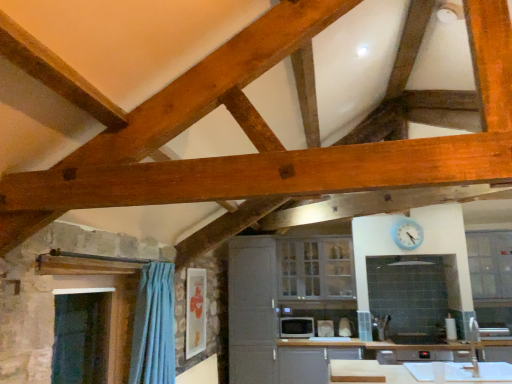
The height and width of the screenshot is (384, 512). Find the location of `free space in front of white glossy microwave at center, which ranks as the first appliance in right-to-left order`. free space in front of white glossy microwave at center, which ranks as the first appliance in right-to-left order is located at coordinates (327, 339).